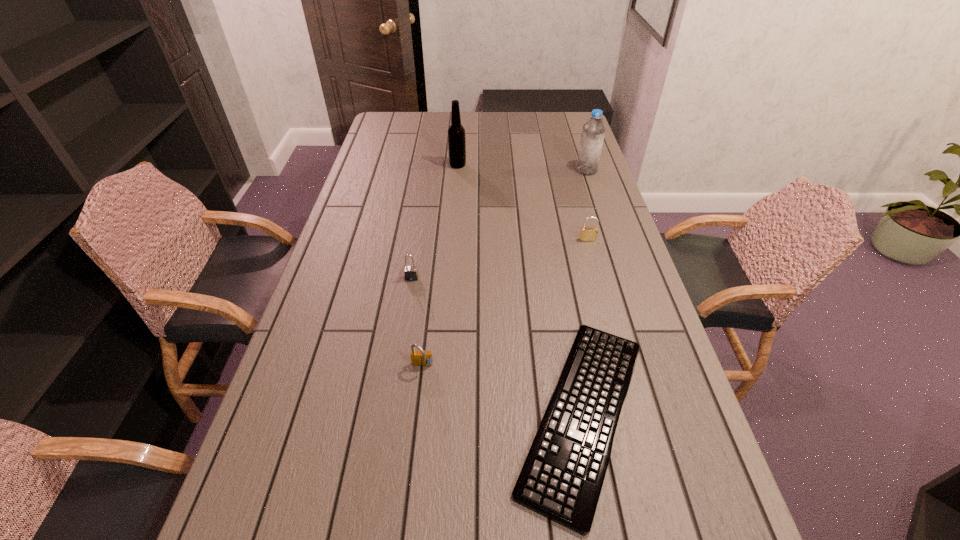
Where is `object identified as the fifth closest to the fourth farthest object`? The height and width of the screenshot is (540, 960). object identified as the fifth closest to the fourth farthest object is located at coordinates (593, 131).

Where is `the second closest object to the second nearest padlock`? This screenshot has height=540, width=960. the second closest object to the second nearest padlock is located at coordinates (561, 479).

The image size is (960, 540). Identify the location of padlock that is the second closest to the computer keyboard. (411, 273).

Locate an element on the screen. The width and height of the screenshot is (960, 540). the second closest padlock relative to the water bottle is located at coordinates (411, 273).

Find the location of `vacant space that satisfies the following two spatial constraints: 1. on the side with the combination dials of the nearest padlock; 2. on the left side of the shortest object`. vacant space that satisfies the following two spatial constraints: 1. on the side with the combination dials of the nearest padlock; 2. on the left side of the shortest object is located at coordinates (418, 413).

Find the location of a particular element. free location that satisfies the following two spatial constraints: 1. on the side with the combination dials of the second padlock from left to right; 2. on the left side of the computer keyboard is located at coordinates (418, 413).